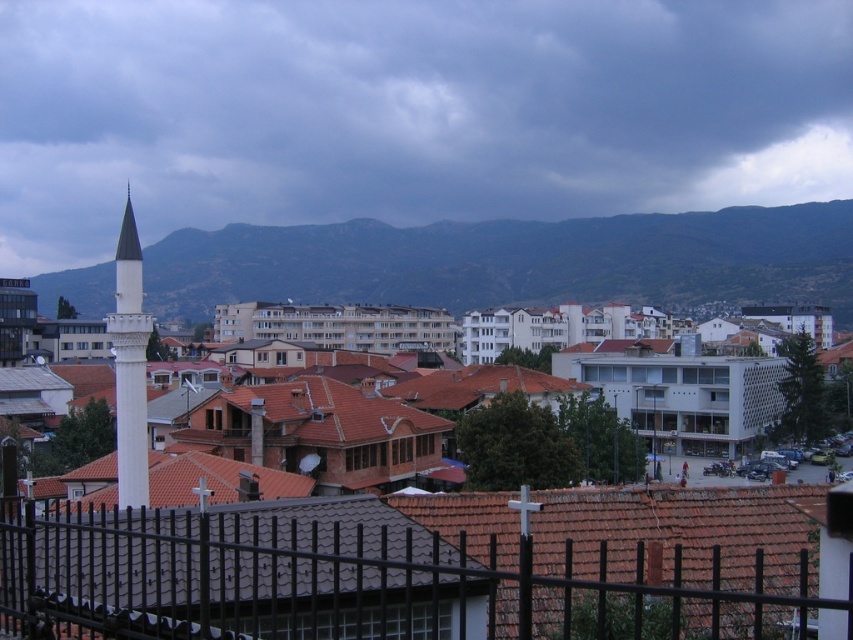
Question: From the image, what is the correct spatial relationship of black metal fence at lower center in relation to white marble minaret at left?

Choices:
 (A) left
 (B) right

Answer: (B)

Question: Considering the relative positions of black metal fence at lower center and green textured mountain at upper center in the image provided, where is black metal fence at lower center located with respect to green textured mountain at upper center?

Choices:
 (A) above
 (B) below

Answer: (B)

Question: Which point is farther to the camera?

Choices:
 (A) green textured mountain at upper center
 (B) black metal fence at lower center
 (C) dark gray cloud at upper center

Answer: (C)

Question: Does black metal fence at lower center appear on the right side of green textured mountain at upper center?

Choices:
 (A) no
 (B) yes

Answer: (A)

Question: Which object is farther from the camera taking this photo?

Choices:
 (A) dark gray cloud at upper center
 (B) brown tile roof at center
 (C) green textured mountain at upper center

Answer: (A)

Question: Which point is farther from the camera taking this photo?

Choices:
 (A) (341, 426)
 (B) (117, 307)
 (C) (711, 116)
 (D) (253, 284)

Answer: (C)